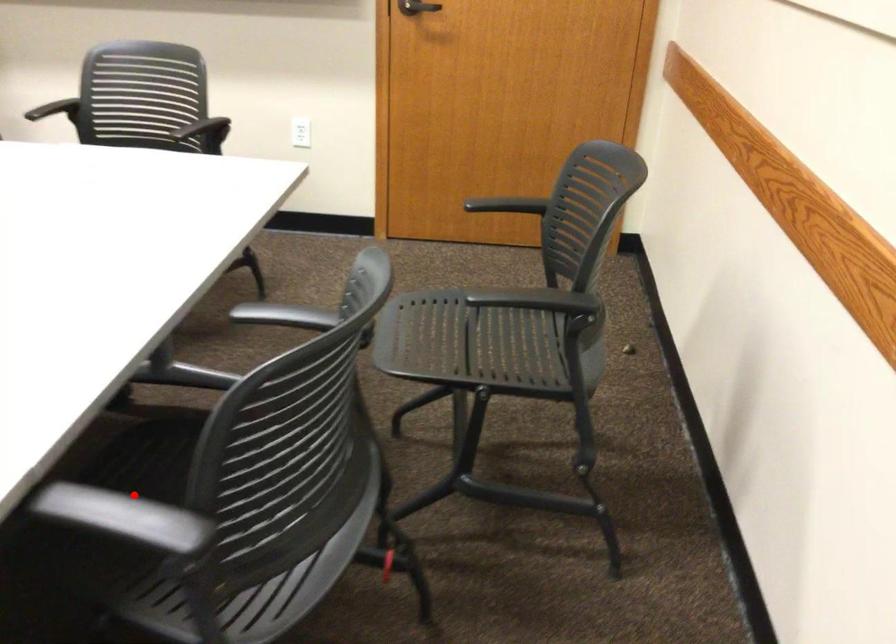
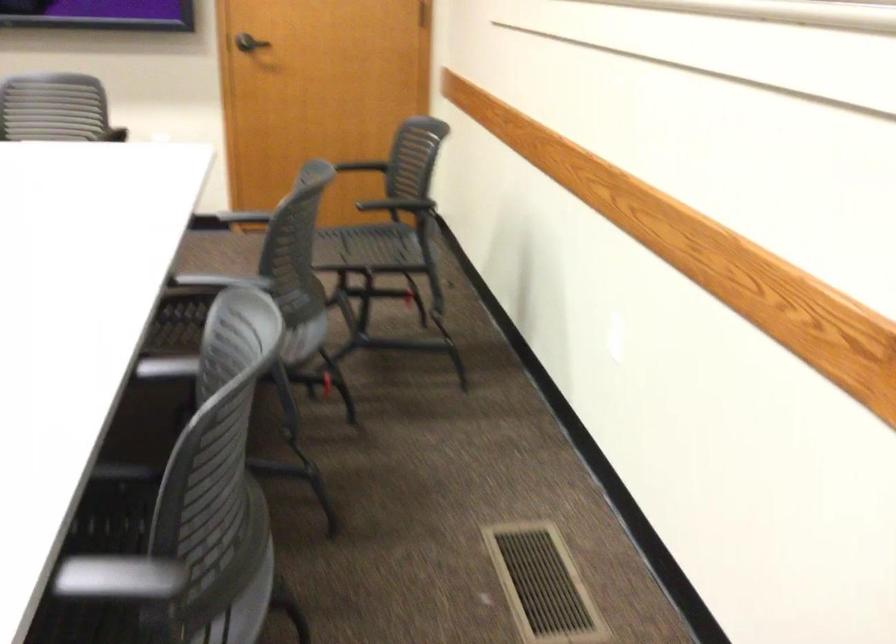
In the second image, find the point that corresponds to the highlighted location in the first image.

(220, 281)